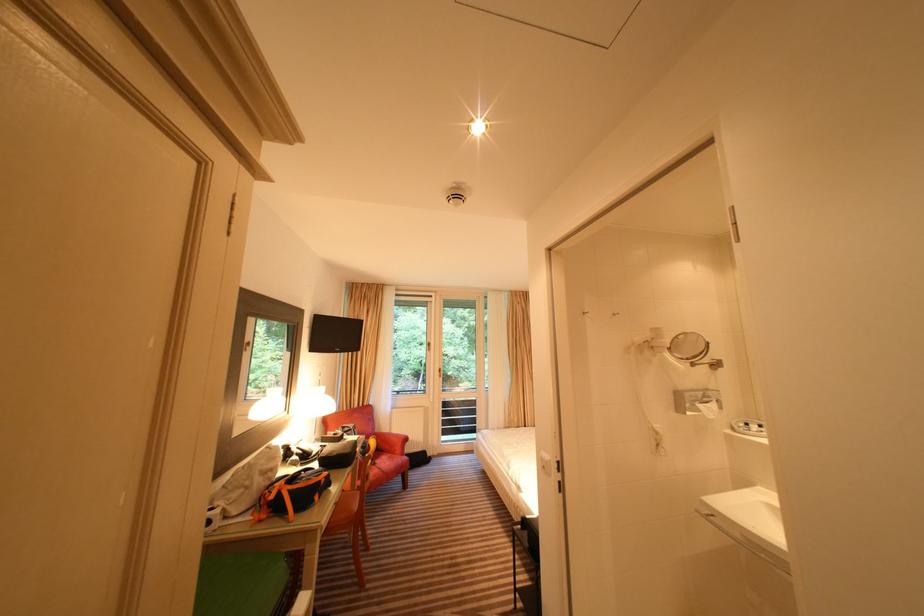
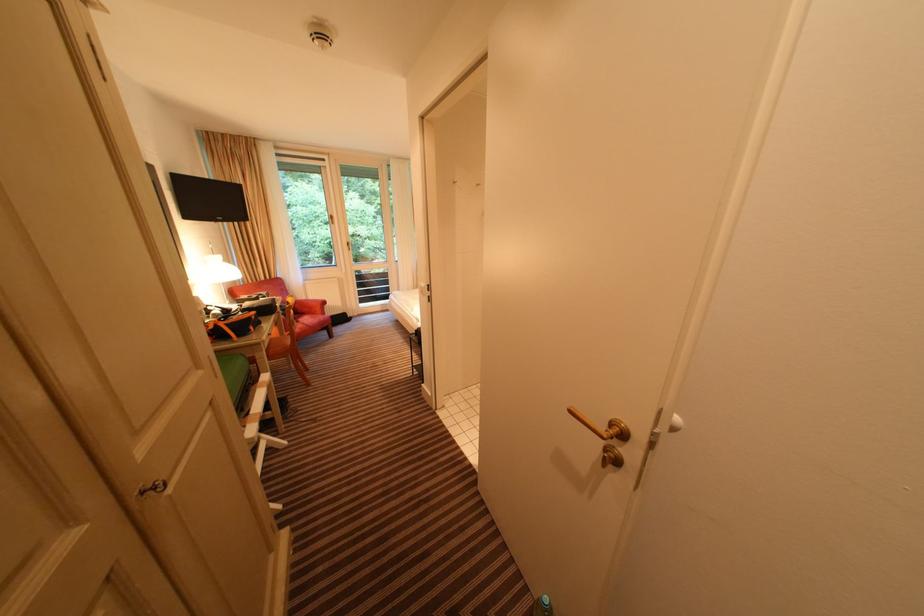
Where in the second image is the point corresponding to (382,466) from the first image?

(305, 323)